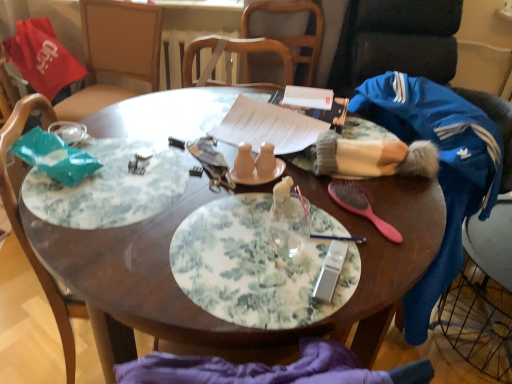
Question: Is wooden chair at left, marked as the first chair in a bottom-to-top arrangement, spatially inside matte ceramic salt and pepper shakers at center, arranged as the third tableware when viewed from the right, or outside of it?

Choices:
 (A) outside
 (B) inside

Answer: (A)

Question: Is wooden chair at left, marked as the first chair in a bottom-to-top arrangement, to the left or to the right of matte ceramic salt and pepper shakers at center, marked as the third tableware in a left-to-right arrangement, in the image?

Choices:
 (A) left
 (B) right

Answer: (A)

Question: Which object is the closest to the blue fleece jacket at right?

Choices:
 (A) wooden chair at left, which is the second chair from back to front
 (B) matte ceramic salt and pepper shakers at center, acting as the 5th tableware starting from the right
 (C) blue fabric swivel chair at right
 (D) metallic silver pen at center, which is counted as the second tableware, starting from the right
 (E) wooden chair at upper center, which appears as the 2th chair when viewed from the front

Answer: (C)

Question: Which of these objects is positioned farthest from the floral-patterned plate at center?

Choices:
 (A) matte ceramic salt and pepper shakers at center, which is the first tableware in left-to-right order
 (B) blue fabric swivel chair at right
 (C) wooden chair at upper center, which appears as the 2th chair when viewed from the front
 (D) blue fleece jacket at right
 (E) green floral placemat at left

Answer: (C)